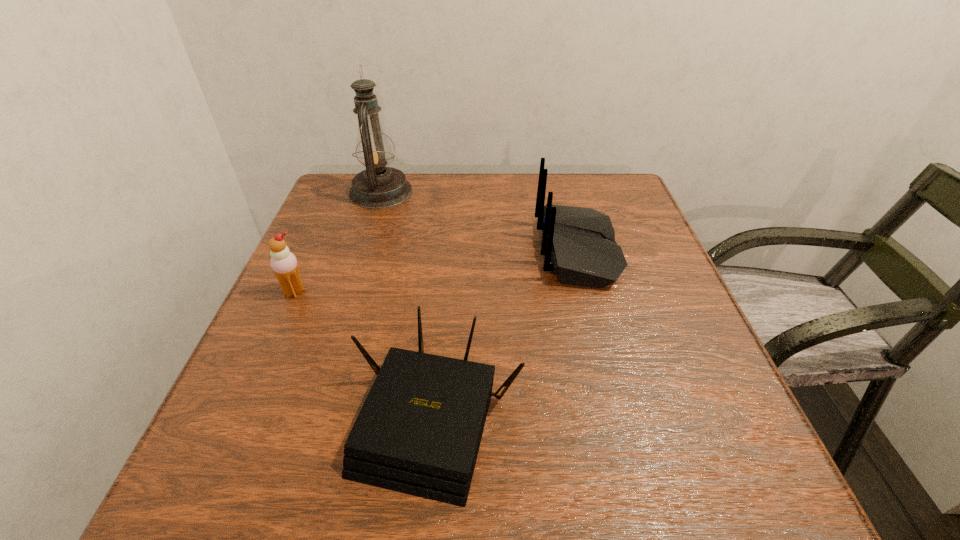
Identify the location of object that is at the far left corner. Image resolution: width=960 pixels, height=540 pixels. (377, 187).

The height and width of the screenshot is (540, 960). What are the coordinates of `object that is at the far right corner` in the screenshot? It's located at (579, 245).

Locate an element on the screen. The height and width of the screenshot is (540, 960). vacant space at the far edge is located at coordinates pos(463,194).

Locate an element on the screen. vacant position at the near edge of the desktop is located at coordinates (525, 500).

At what (x,y) coordinates should I click in order to perform the action: click on free spot at the left edge of the desktop. Please return your answer as a coordinate pair (x, y). This screenshot has width=960, height=540. Looking at the image, I should click on (322, 310).

Where is `vacant space at the right edge`? This screenshot has height=540, width=960. vacant space at the right edge is located at coordinates (651, 367).

Find the location of a particular element. This screenshot has width=960, height=540. free spot at the far left corner of the desktop is located at coordinates (336, 187).

This screenshot has width=960, height=540. In the image, there is a desktop. In order to click on vacant region at the near left corner in this screenshot , I will do `click(300, 459)`.

This screenshot has height=540, width=960. I want to click on free spot at the far right corner of the desktop, so tap(611, 187).

In the image, there is a desktop. Identify the location of vacant area at the near right corner. (743, 495).